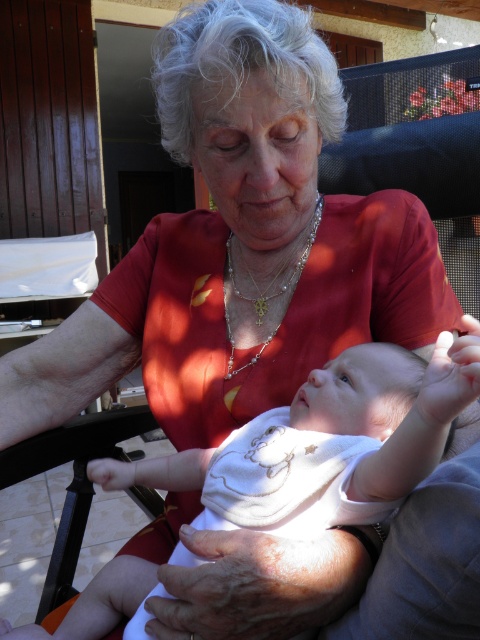
You are a photographer adjusting your camera to focus on two points in the image. The first point is point [312,381] and the second is point [227,317]. Which point should you focus on first if you want to start with the one closer to the camera?

Point [312,381] is closer to the camera than point [227,317], so you should focus on point [312,381] first.